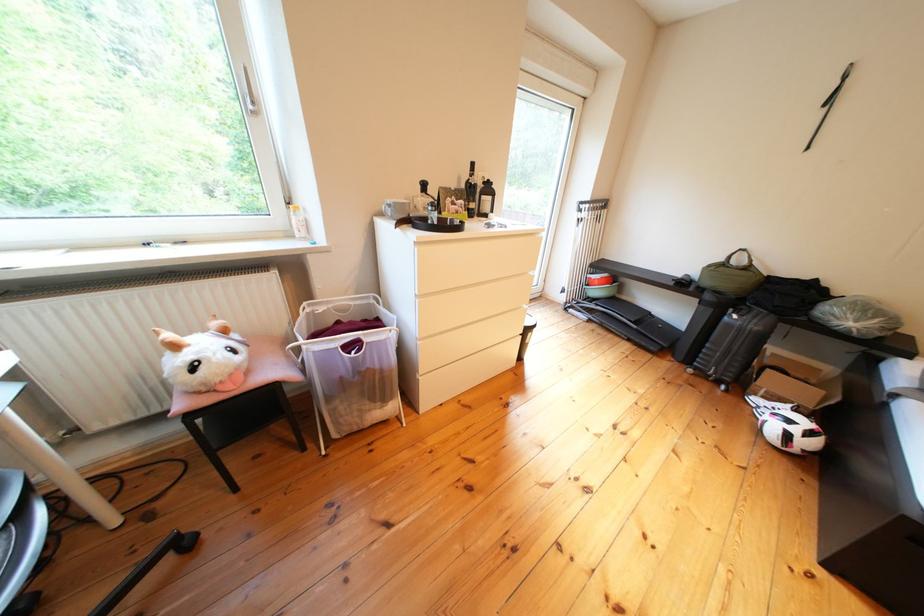
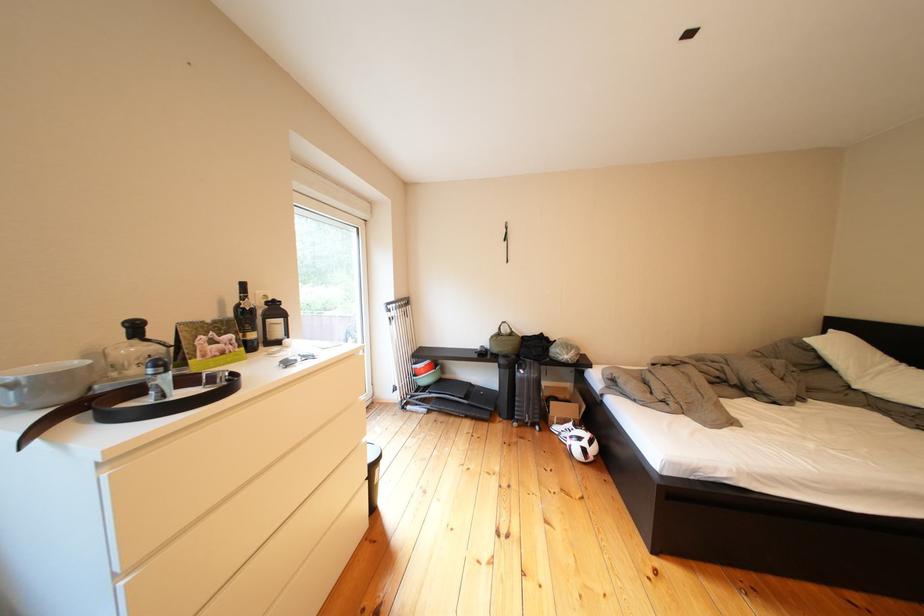
The point at (476,207) is marked in the first image. Where is the corresponding point in the second image?

(245, 341)